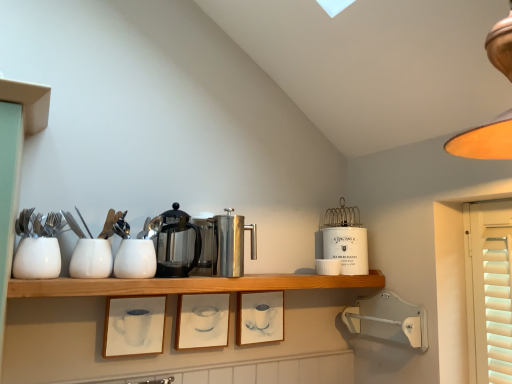
This screenshot has width=512, height=384. I want to click on vacant space that is to the left of white ceramic cup at upper right, which is the first tableware from back to front, so click(282, 276).